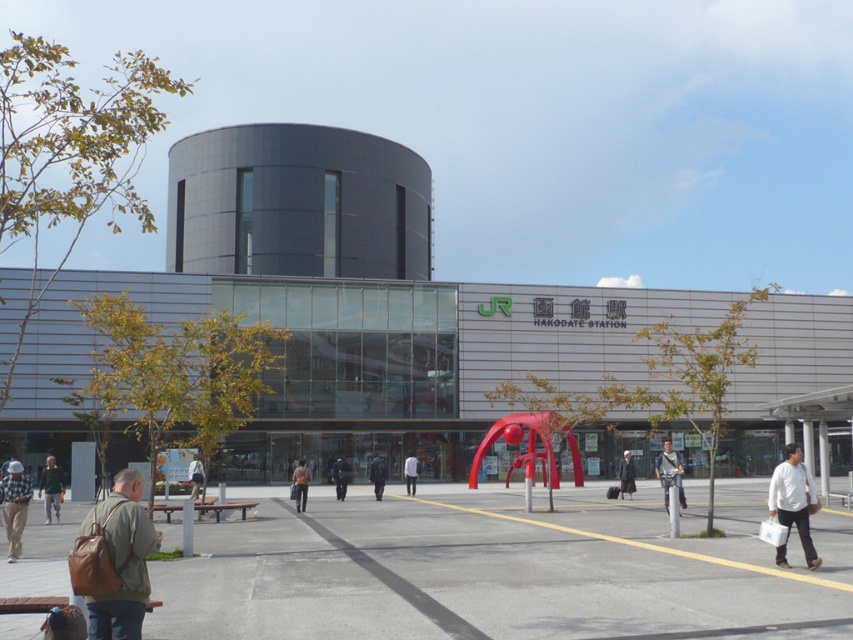
Question: Which point is farther to the camera?

Choices:
 (A) concrete plaza at lower left
 (B) orange fabric bag at center

Answer: (B)

Question: Which point is closer to the camera?

Choices:
 (A) (376, 490)
 (B) (622, 472)

Answer: (B)

Question: Is concrete plaza at lower left thinner than white matte shirt at lower right?

Choices:
 (A) yes
 (B) no

Answer: (B)

Question: Can you confirm if white matte shirt at lower right is wider than green fabric jacket at lower left?

Choices:
 (A) no
 (B) yes

Answer: (A)

Question: Which point is farther from the camera taking this photo?

Choices:
 (A) (192, 497)
 (B) (380, 458)
 (C) (111, 493)
 (D) (807, 472)

Answer: (B)

Question: Is matte glass building at center thinner than light beige fabric coat at center?

Choices:
 (A) no
 (B) yes

Answer: (A)